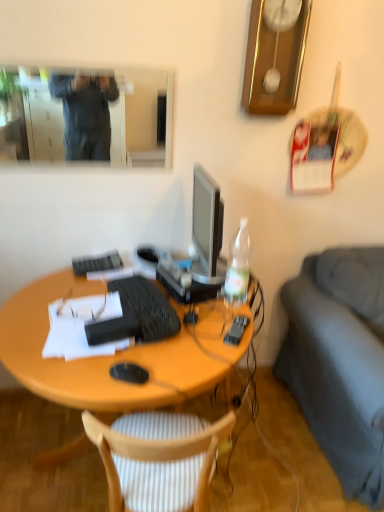
Where is `vacant area that lies between black matte computer mouse at center and clear plastic bottle at right`? This screenshot has width=384, height=512. vacant area that lies between black matte computer mouse at center and clear plastic bottle at right is located at coordinates (195, 333).